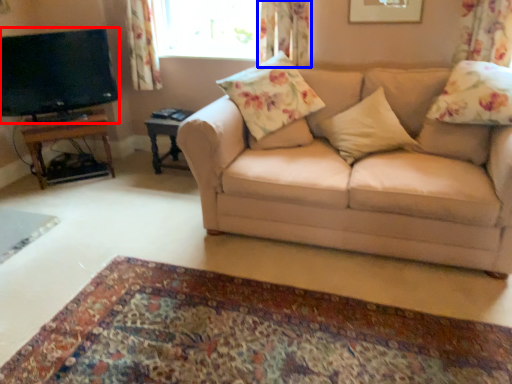
Question: Which object appears closest to the camera in this image, television (highlighted by a red box) or curtain (highlighted by a blue box)?

Choices:
 (A) television
 (B) curtain

Answer: (A)